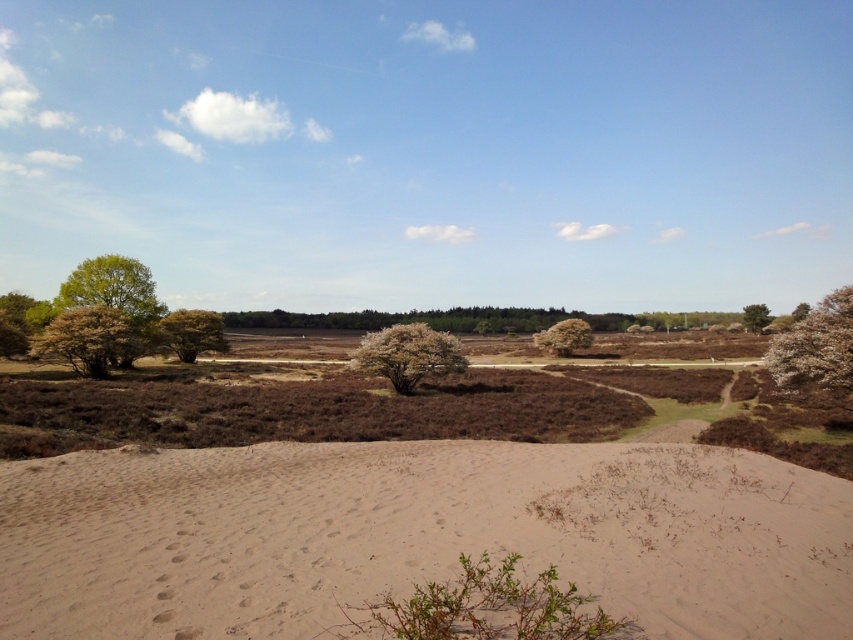
Question: Is green leafy bush at left above green leafy tree at left?

Choices:
 (A) no
 (B) yes

Answer: (A)

Question: Is light brown sandy dunes at lower left to the right of green leafy tree at center from the viewer's perspective?

Choices:
 (A) yes
 (B) no

Answer: (B)

Question: Which point is closer to the camera?

Choices:
 (A) white fluffy tree at right
 (B) green leafy tree at center
 (C) white textured tree at center

Answer: (A)

Question: Can you confirm if green leafy tree at upper left is positioned to the left of green leafy tree at center?

Choices:
 (A) no
 (B) yes

Answer: (B)

Question: Based on their relative distances, which object is farther from the green leafy tree at upper right?

Choices:
 (A) green leafy tree at upper left
 (B) green leafy bush at left
 (C) white textured tree at upper right
 (D) white fluffy tree at right

Answer: (A)

Question: Among these points, which one is nearest to the camera?

Choices:
 (A) (824, 387)
 (B) (544, 336)
 (C) (749, 330)

Answer: (A)